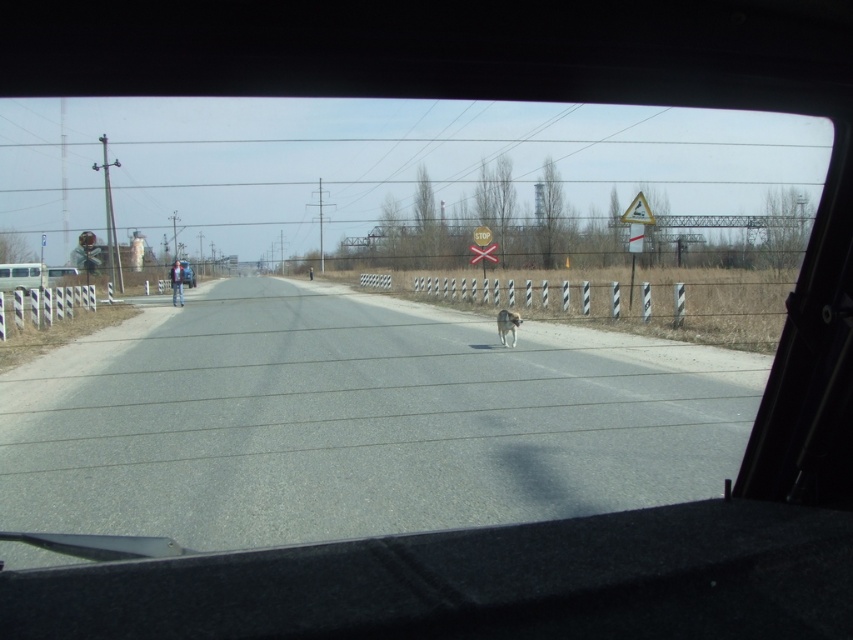
Question: Does white matte van at left appear over white fur dog at center?

Choices:
 (A) no
 (B) yes

Answer: (B)

Question: Which of the following is the closest to the observer?

Choices:
 (A) (514, 332)
 (B) (33, 272)

Answer: (A)

Question: Can you confirm if transparent glass windshield at center is bigger than black rubber dashboard at lower center?

Choices:
 (A) yes
 (B) no

Answer: (A)

Question: Estimate the real-world distances between objects in this image. Which object is farther from the white matte van at left?

Choices:
 (A) white fur dog at center
 (B) transparent glass windshield at center

Answer: (A)

Question: Is white matte van at left above white fur dog at center?

Choices:
 (A) no
 (B) yes

Answer: (B)

Question: Estimate the real-world distances between objects in this image. Which object is closer to the white matte van at left?

Choices:
 (A) white fur dog at center
 (B) transparent glass windshield at center

Answer: (B)